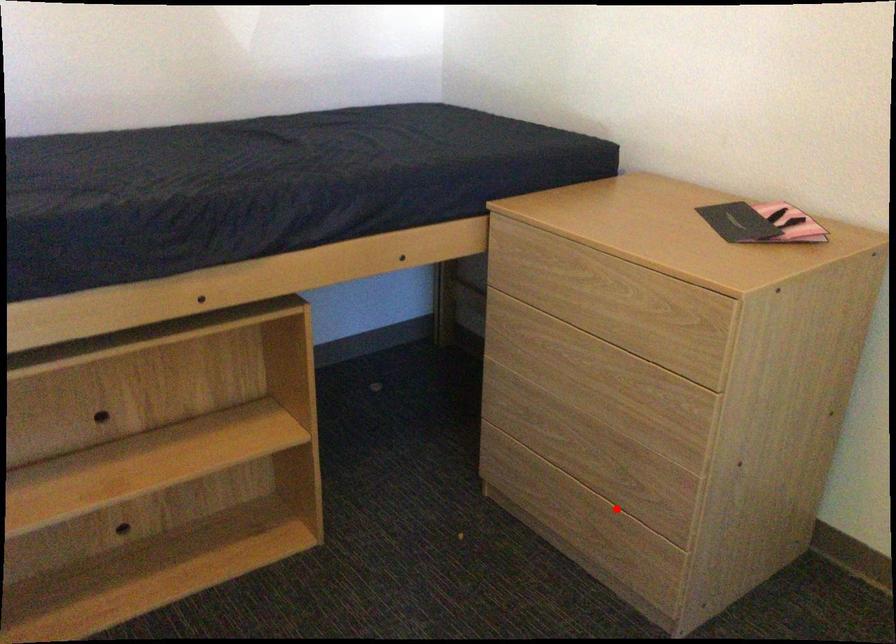
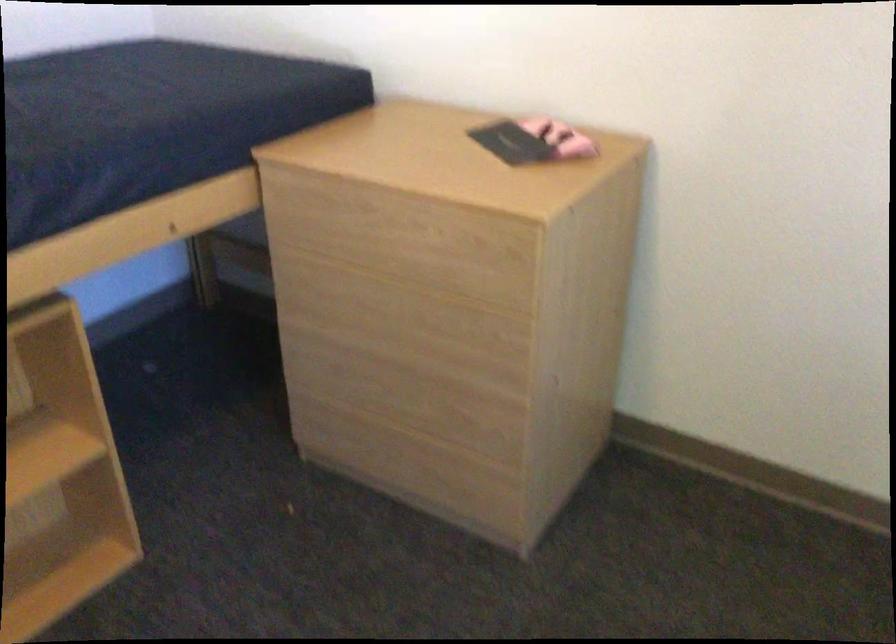
Where in the second image is the point corresponding to the highlighted location from the first image?

(451, 440)